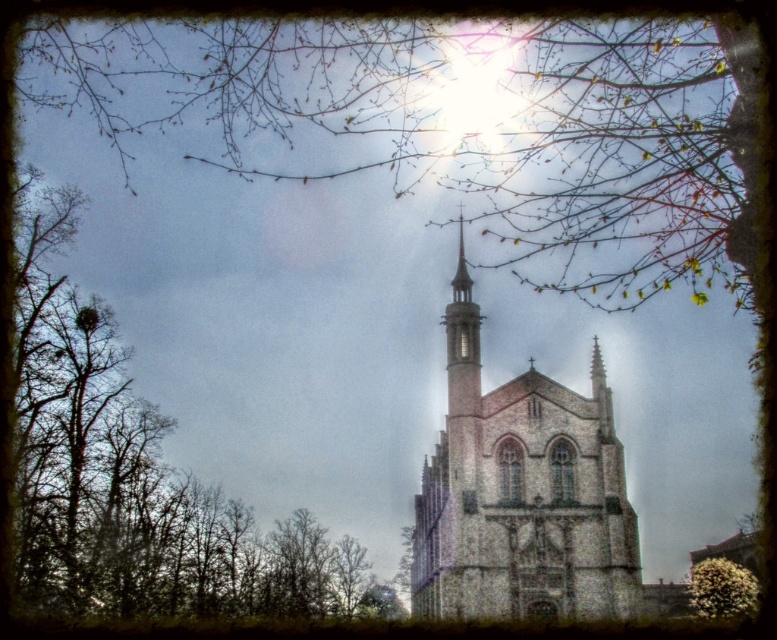
From the picture: You are standing in front of the Gothic church and want to take a photo of its spire. The brown leafless tree at left is blocking your view. Where is the tree located relative to the spire?

The brown leafless tree at left is located at point (138, 476), which is to the left side of the spire, partially obscuring the view.

You are standing in front of the Gothic church and want to take a photo that includes both the brick stone tower at center and the green fuzzy bush at lower right. Which object should you focus on first to ensure both are in clear view?

You should focus on the brick stone tower at center first since it is closer to the viewer than the green fuzzy bush at lower right, ensuring both will be in clear focus when focused on the closer object.

You are standing in front of the Gothic church and want to take a photo of the brick stone tower at center. Where should you position your camera to capture the tower in the frame?

The brick stone tower at center is located at coordinates 0.772 on the x axis and 0.672 on the y axis, so position your camera to aim towards those coordinates to capture the tower in the frame.